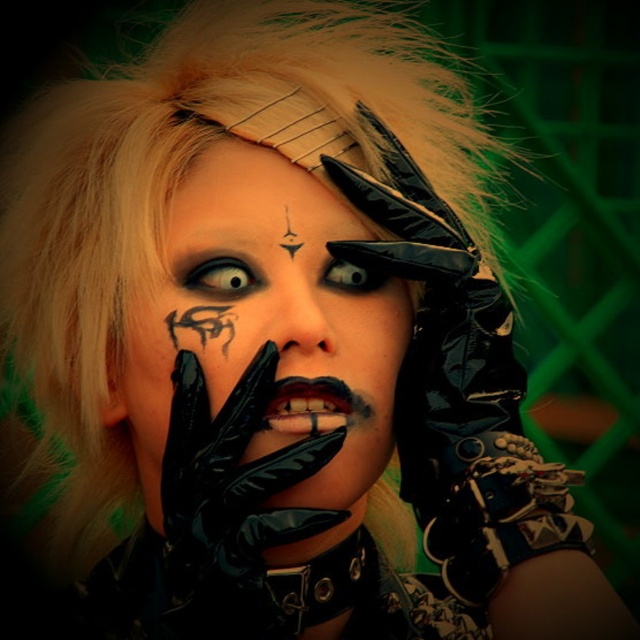
You are an artist trying to sketch this person. You need to decide the order to draw the elements based on their positions. Should you draw the black glossy glove at center before or after the smokey gray eye at center?

The black glossy glove at center is located below the smokey gray eye at center, so you should draw the smokey gray eye at center first and then the black glossy glove at center to maintain the correct spatial arrangement.

Looking at the person in the image, where is the black tattoo at center in relation to the smokey gray eye at center?

The black tattoo at center is to the left of the smokey gray eye at center.

From the picture: What object is located at the coordinates point (232,477) in the image?

The point (232,477) indicates the location of the black glossy glove at center.